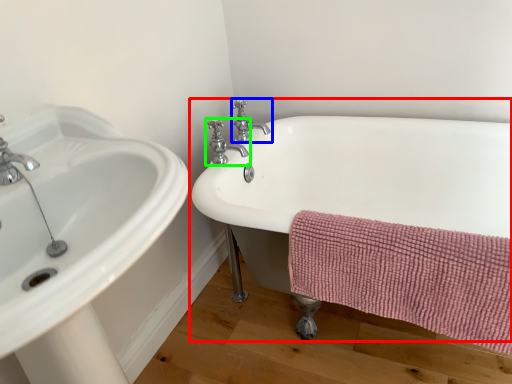
Question: Which is farther away from bathtub (highlighted by a red box)? tap (highlighted by a blue box) or tap (highlighted by a green box)?

Choices:
 (A) tap
 (B) tap

Answer: (A)